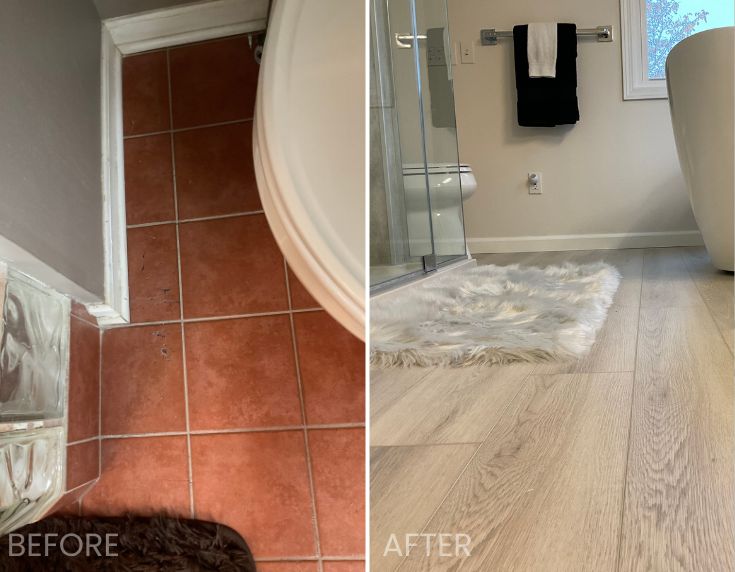
This screenshot has height=572, width=735. Find the location of `toilet`. toilet is located at coordinates (304, 281), (437, 226).